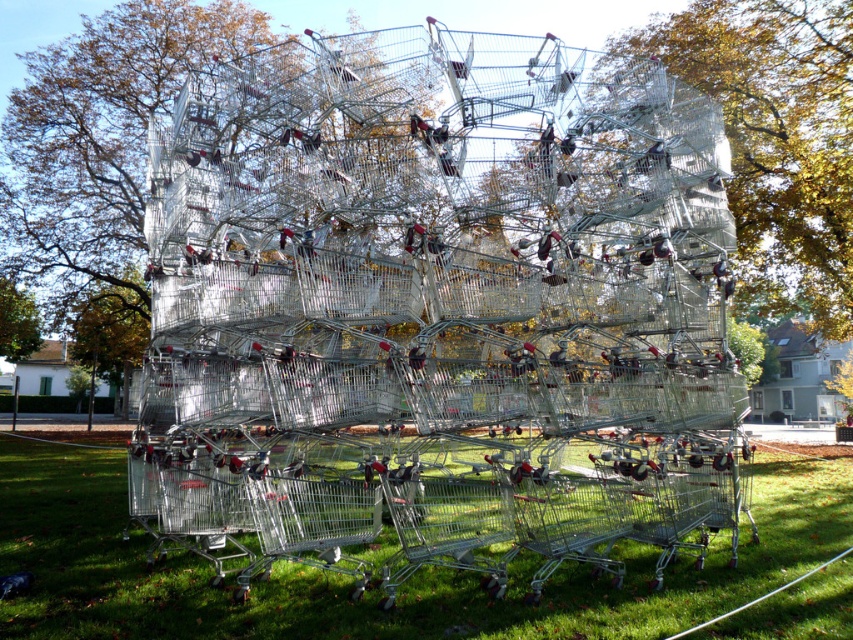
What do you see at coordinates (438, 289) in the screenshot? Image resolution: width=853 pixels, height=640 pixels. I see `metallic silver shopping cart at center` at bounding box center [438, 289].

Where is `metallic silver shopping cart at center`? The image size is (853, 640). metallic silver shopping cart at center is located at coordinates (438, 289).

Which is behind, point (582, 289) or point (741, 228)?

Point (741, 228)

Locate an element on the screen. metallic silver shopping cart at center is located at coordinates (438, 289).

Who is shorter, green grass at center or green leafy tree at upper left?

Standing shorter between the two is green grass at center.

Does green grass at center appear on the left side of green leafy tree at upper left?

In fact, green grass at center is to the right of green leafy tree at upper left.

Between point (132, 545) and point (0, 348), which one is positioned in front?

Point (132, 545) is more forward.

Identify the location of green grass at center. The image size is (853, 640). (374, 588).

This screenshot has height=640, width=853. Describe the element at coordinates (374, 588) in the screenshot. I see `green grass at center` at that location.

Can you confirm if green grass at center is shorter than green leafy tree at center?

Indeed, green grass at center has a lesser height compared to green leafy tree at center.

The image size is (853, 640). Find the location of `green grass at center`. green grass at center is located at coordinates (374, 588).